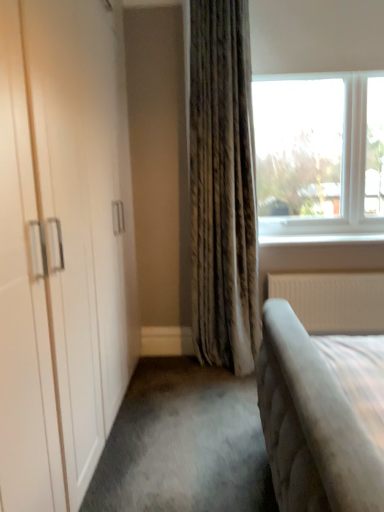
Where is `clear glass window at upper right`? This screenshot has height=512, width=384. clear glass window at upper right is located at coordinates (319, 154).

What are the coordinates of `white glossy window sill at upper right` in the screenshot? It's located at (320, 240).

From the image's perspective, between clear glass window at upper right and white textured radiator at lower right, which one is located above?

From the image's view, clear glass window at upper right is above.

From a real-world perspective, is clear glass window at upper right positioned above or below white textured radiator at lower right?

clear glass window at upper right is above white textured radiator at lower right.

Considering the sizes of objects clear glass window at upper right and white textured radiator at lower right in the image provided, who is shorter, clear glass window at upper right or white textured radiator at lower right?

white textured radiator at lower right is shorter.

How many degrees apart are the facing directions of clear glass window at upper right and white textured radiator at lower right?

There is a 0.325-degree angle between the facing directions of clear glass window at upper right and white textured radiator at lower right.

Based on the photo, between white textured radiator at lower right and clear glass window at upper right, which one has larger width?

clear glass window at upper right is wider.

From the picture: Is white textured radiator at lower right spatially inside clear glass window at upper right, or outside of it?

white textured radiator at lower right exists outside the volume of clear glass window at upper right.

Could you tell me if white textured radiator at lower right is facing clear glass window at upper right?

No, white textured radiator at lower right does not turn towards clear glass window at upper right.

You are a GUI agent. You are given a task and a screenshot of the screen. Output one action in this format:
    pyautogui.click(x=<x>, y=<y>)
    Task: Click on the radiator that appears behind the clear glass window at upper right
    The image size is (384, 512).
    Given the screenshot: What is the action you would take?
    pyautogui.click(x=333, y=300)

Does white textured radiator at lower right come behind white glossy window sill at upper right?

No, white textured radiator at lower right is in front of white glossy window sill at upper right.

Does white textured radiator at lower right have a lesser width compared to white glossy window sill at upper right?

Yes.

Is white textured radiator at lower right oriented away from white glossy window sill at upper right?

That's not correct — white textured radiator at lower right is not looking away from white glossy window sill at upper right.

Which is more to the right, white glossy window sill at upper right or white textured radiator at lower right?

From the viewer's perspective, white textured radiator at lower right appears more on the right side.

In terms of width, does white glossy window sill at upper right look wider or thinner when compared to white textured radiator at lower right?

Considering their sizes, white glossy window sill at upper right looks broader than white textured radiator at lower right.

Does white glossy window sill at upper right have a smaller size compared to white textured radiator at lower right?

Correct, white glossy window sill at upper right occupies less space than white textured radiator at lower right.

Is white glossy window sill at upper right facing towards white textured radiator at lower right?

No, white glossy window sill at upper right is not oriented towards white textured radiator at lower right.

Is clear glass window at upper right far from white glossy window sill at upper right?

That's not correct — clear glass window at upper right is a little close to white glossy window sill at upper right.

From their relative heights in the image, would you say clear glass window at upper right is taller or shorter than white glossy window sill at upper right?

Clearly, clear glass window at upper right is taller compared to white glossy window sill at upper right.

Is clear glass window at upper right positioned in front of white glossy window sill at upper right?

Yes, it is.

Would you say clear glass window at upper right contains white glossy window sill at upper right?

Yes.

Is white glossy window sill at upper right to the left or to the right of clear glass window at upper right in the image?

From the image, it's evident that white glossy window sill at upper right is to the right of clear glass window at upper right.

From a real-world perspective, is white glossy window sill at upper right located higher than clear glass window at upper right?

No.

From the image's perspective, is white glossy window sill at upper right positioned above or below clear glass window at upper right?

Based on their image positions, white glossy window sill at upper right is located beneath clear glass window at upper right.

In the image, there is a clear glass window at upper right. Identify the location of window sill below it (from the image's perspective). Image resolution: width=384 pixels, height=512 pixels. (320, 240).

Locate an element on the screen. window above the white textured radiator at lower right (from the image's perspective) is located at coordinates (319, 154).

Find the location of `window on the left side of white textured radiator at lower right`. window on the left side of white textured radiator at lower right is located at coordinates (319, 154).

Based on their spatial positions, is clear glass window at upper right or white glossy window sill at upper right further from white textured radiator at lower right?

Among the two, clear glass window at upper right is located further to white textured radiator at lower right.

When comparing their distances from white glossy window sill at upper right, does white textured radiator at lower right or clear glass window at upper right seem further?

Among the two, clear glass window at upper right is located further to white glossy window sill at upper right.

Looking at the image, which one is located further to clear glass window at upper right, white textured radiator at lower right or white glossy window sill at upper right?

Based on the image, white textured radiator at lower right appears to be further to clear glass window at upper right.

Which object lies nearer to the anchor point white textured radiator at lower right, white glossy window sill at upper right or clear glass window at upper right?

The object closer to white textured radiator at lower right is white glossy window sill at upper right.

Consider the image. From the image, which object appears to be farther from white glossy window sill at upper right, clear glass window at upper right or white textured radiator at lower right?

clear glass window at upper right is further to white glossy window sill at upper right.

Based on their spatial positions, is white glossy window sill at upper right or white textured radiator at lower right closer to clear glass window at upper right?

The object closer to clear glass window at upper right is white glossy window sill at upper right.

The width and height of the screenshot is (384, 512). I want to click on window sill between clear glass window at upper right and white textured radiator at lower right vertically, so click(320, 240).